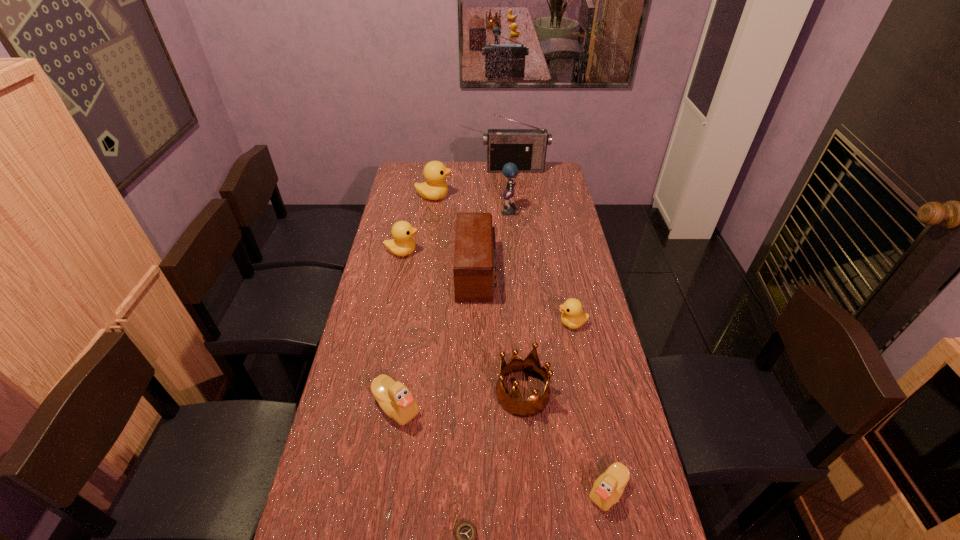
Where is `vacant region located at the beak of the smaller beige duck`? The image size is (960, 540). vacant region located at the beak of the smaller beige duck is located at coordinates (457, 491).

Where is `object that is positioned at the far edge`? The height and width of the screenshot is (540, 960). object that is positioned at the far edge is located at coordinates (526, 148).

The image size is (960, 540). What are the coordinates of `radio receiver that is positioned at the right edge` in the screenshot? It's located at (526, 148).

This screenshot has width=960, height=540. Find the location of `object that is positioned at the far right corner`. object that is positioned at the far right corner is located at coordinates [x=526, y=148].

At what (x,y) coordinates should I click in order to perform the action: click on vacant region at the far edge of the desktop. Please return your answer as a coordinate pair (x, y). The image size is (960, 540). Looking at the image, I should click on (487, 176).

Find the location of a particular element. free point at the left edge is located at coordinates (317, 499).

This screenshot has height=540, width=960. I want to click on free space at the right edge of the desktop, so click(x=544, y=228).

The width and height of the screenshot is (960, 540). Identify the location of vacant region at the far right corner of the desktop. (551, 165).

Where is `free space that is in between the shorter radio receiver and the taller radio receiver`? The height and width of the screenshot is (540, 960). free space that is in between the shorter radio receiver and the taller radio receiver is located at coordinates (496, 221).

The width and height of the screenshot is (960, 540). I want to click on free spot between the left beige duck and the second farthest duck, so click(399, 329).